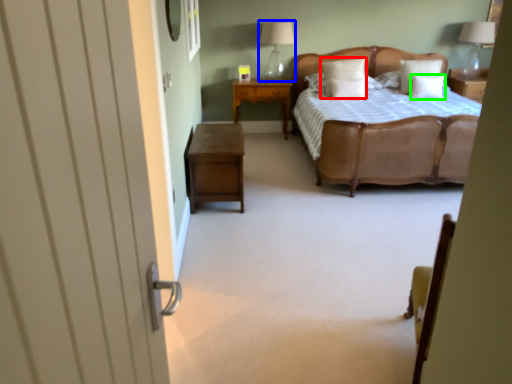
Question: Which is farther away from pillow (highlighted by a red box)? table lamp (highlighted by a blue box) or pillow (highlighted by a green box)?

Choices:
 (A) table lamp
 (B) pillow

Answer: (A)